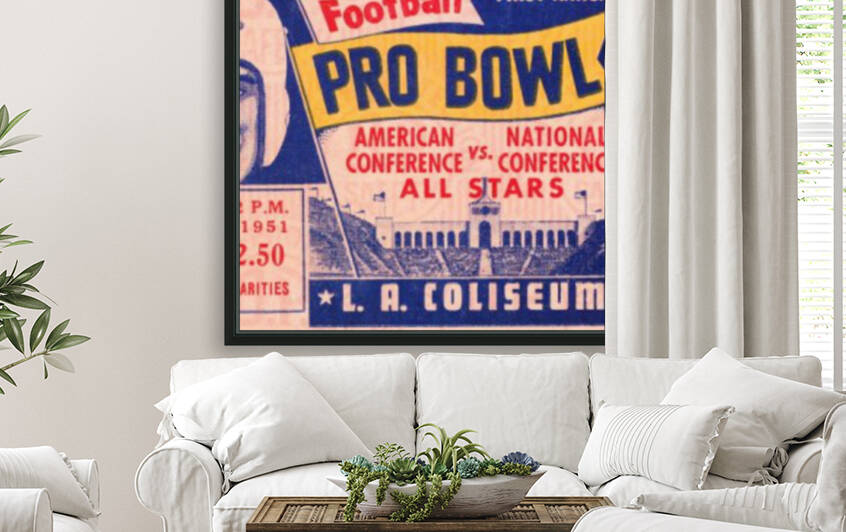
Where is `throaw pillow`? throaw pillow is located at coordinates (277, 423), (677, 435), (757, 403), (37, 478).